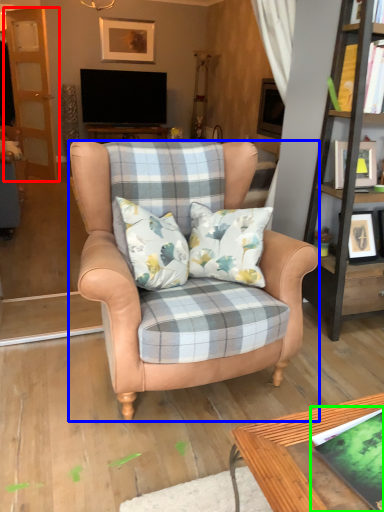
Question: Based on their relative distances, which object is nearer to screen door (highlighted by a red box)? Choose from chair (highlighted by a blue box) and book (highlighted by a green box).

Choices:
 (A) chair
 (B) book

Answer: (A)